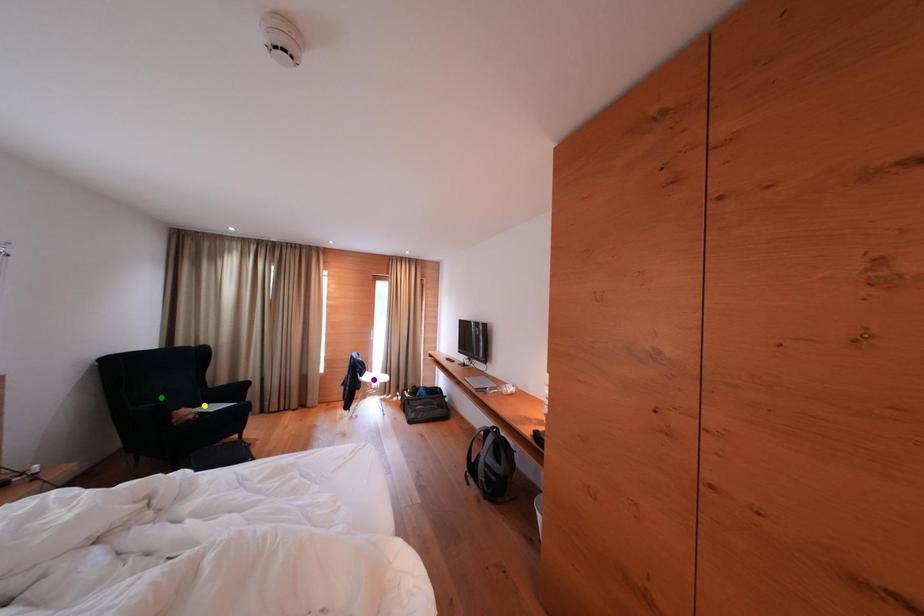
Order these from nearest to farthest:
1. purple point
2. yellow point
3. green point

purple point, yellow point, green point